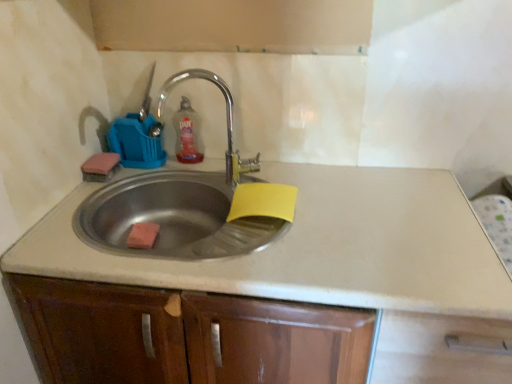
Question: Choose the correct answer: Is beige laminate countertop at center inside translucent plastic bottle at upper center or outside it?

Choices:
 (A) inside
 (B) outside

Answer: (B)

Question: Considering the positions of beige laminate countertop at center and translucent plastic bottle at upper center in the image, is beige laminate countertop at center taller or shorter than translucent plastic bottle at upper center?

Choices:
 (A) short
 (B) tall

Answer: (B)

Question: Considering the real-world distances, which object is farthest from the stainless steel sink at center?

Choices:
 (A) beige laminate countertop at center
 (B) orange sponge at sink
 (C) translucent plastic bottle at upper center

Answer: (C)

Question: Which object is positioned farthest from the orange sponge at sink?

Choices:
 (A) stainless steel sink at center
 (B) beige laminate countertop at center
 (C) translucent plastic bottle at upper center

Answer: (B)